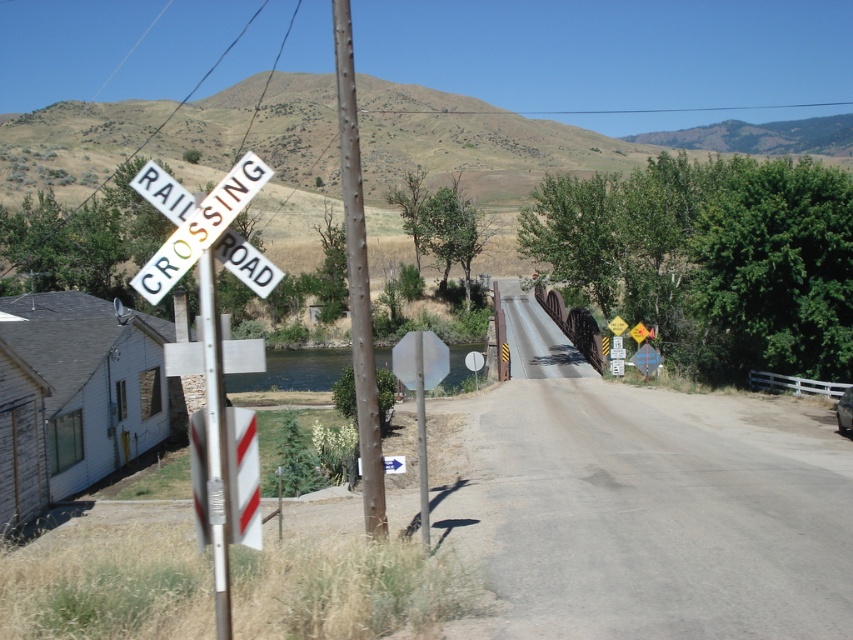
Question: Which object is positioned farthest from the white plastic railroad crossing sign at left?

Choices:
 (A) metallic pole at left
 (B) rusty metal pole at center

Answer: (B)

Question: Can you confirm if white plastic railroad crossing sign at left is smaller than metallic pole at left?

Choices:
 (A) no
 (B) yes

Answer: (A)

Question: Does white plastic railroad crossing sign at left have a greater width compared to metallic pole at left?

Choices:
 (A) no
 (B) yes

Answer: (B)

Question: Which point is closer to the camera?

Choices:
 (A) rusty metal pole at center
 (B) metallic pole at left

Answer: (B)

Question: Which point appears farthest from the camera in this image?

Choices:
 (A) (229, 634)
 (B) (196, 218)
 (C) (341, 86)

Answer: (C)

Question: Does rusty metal pole at center have a greater width compared to metallic pole at left?

Choices:
 (A) yes
 (B) no

Answer: (A)